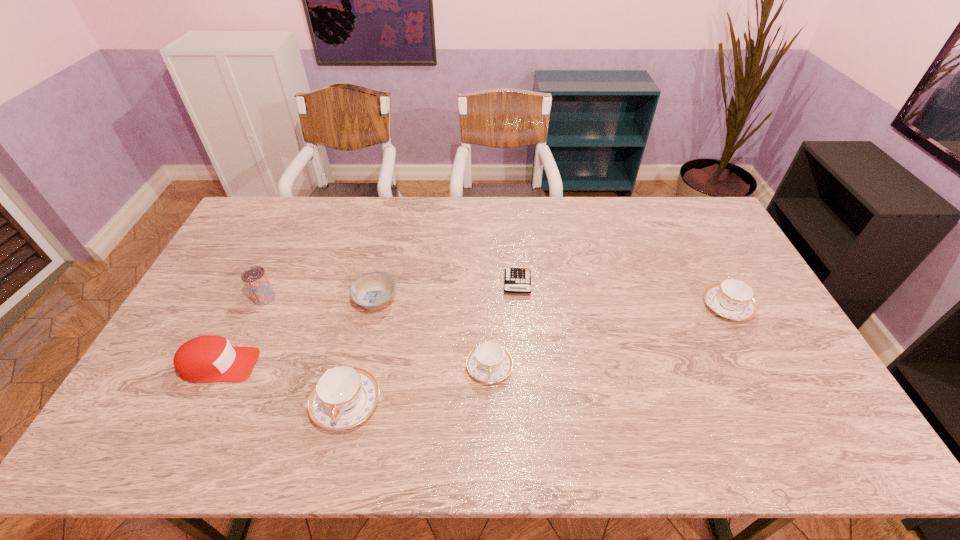
This screenshot has height=540, width=960. I want to click on free spot at the near edge of the desktop, so click(x=415, y=406).

The height and width of the screenshot is (540, 960). What are the coordinates of `vacant space at the right edge of the desktop` in the screenshot? It's located at (777, 376).

Find the location of a particular element. The image size is (960, 540). free space at the far left corner of the desktop is located at coordinates (290, 202).

Locate an element on the screen. Image resolution: width=960 pixels, height=540 pixels. free point at the far right corner is located at coordinates (703, 211).

Where is `blank region between the beer can and the leftmost teacup`? Image resolution: width=960 pixels, height=540 pixels. blank region between the beer can and the leftmost teacup is located at coordinates (305, 350).

Locate an element on the screen. free spot between the bowl and the baseball cap is located at coordinates (298, 333).

This screenshot has width=960, height=540. In order to click on empty space between the rightmost object and the bowl in this screenshot , I will do [552, 304].

Identify the location of empty location between the leftmost teacup and the shortest object. Image resolution: width=960 pixels, height=540 pixels. (432, 343).

Locate an element on the screen. empty space between the baseball cap and the shortest object is located at coordinates (368, 325).

Locate an element on the screen. free space between the baseball cap and the beer can is located at coordinates (242, 332).